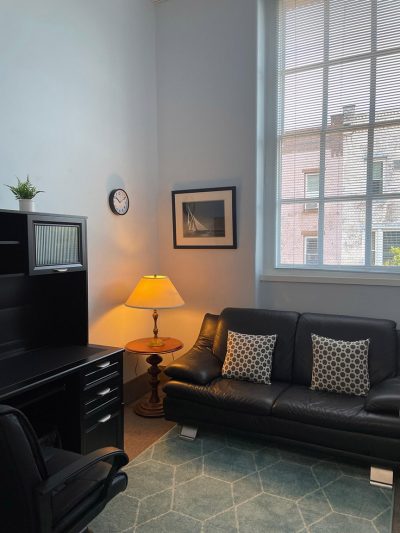
Where is `rug`? The height and width of the screenshot is (533, 400). rug is located at coordinates tap(212, 505).